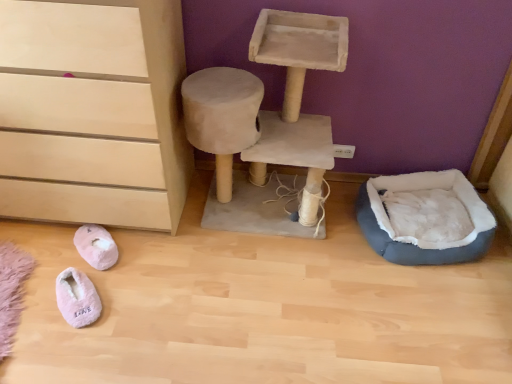
Where is `vacant area on top of pink fluffy slippers at lower left, which is the first footwear from front to back (from a real-world perspective)`? The image size is (512, 384). vacant area on top of pink fluffy slippers at lower left, which is the first footwear from front to back (from a real-world perspective) is located at coordinates (73, 287).